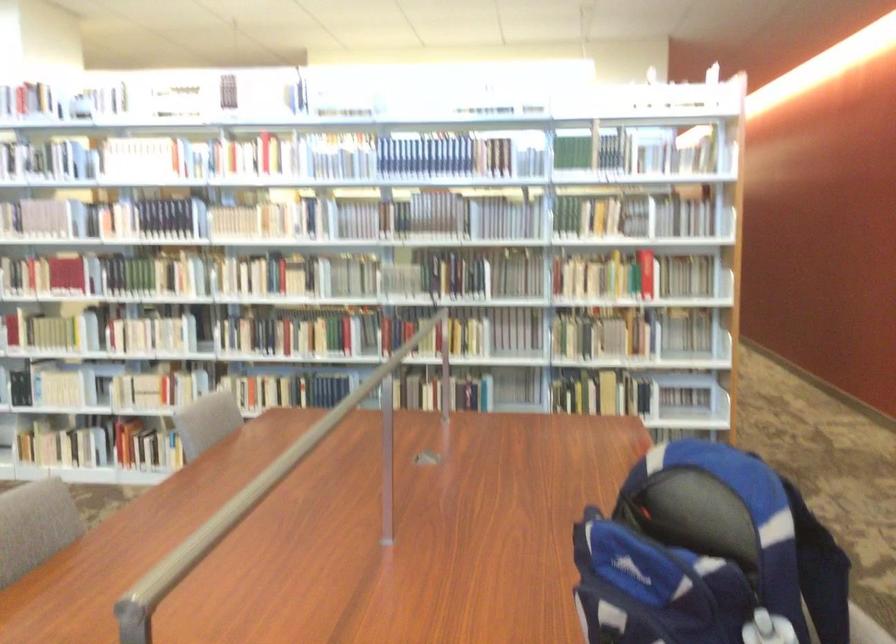
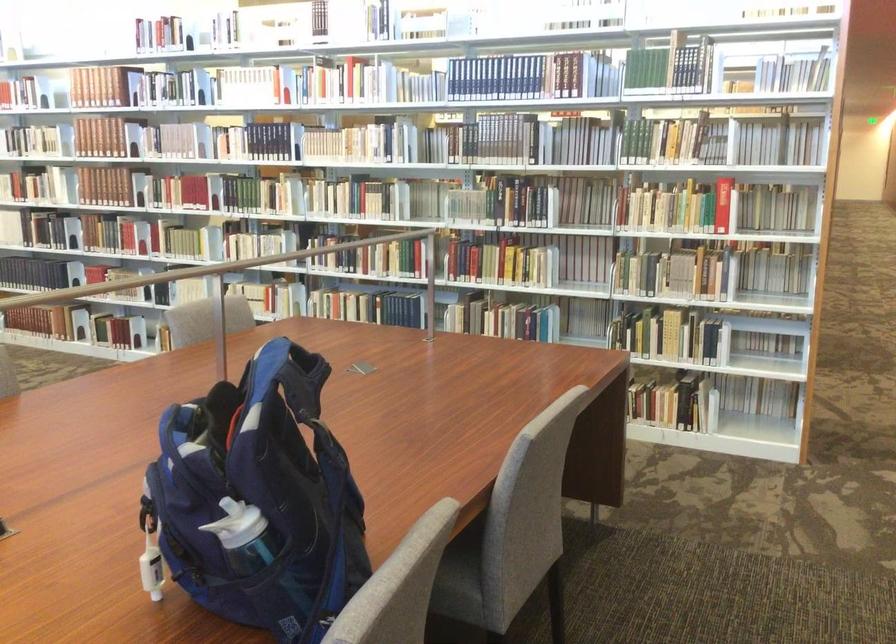
Question: Which direction would the cameraman need to move to produce the second image? Reply with the corresponding letter.

Choices:
 (A) Left
 (B) Right
 (C) Forward
 (D) Backward

Answer: (B)